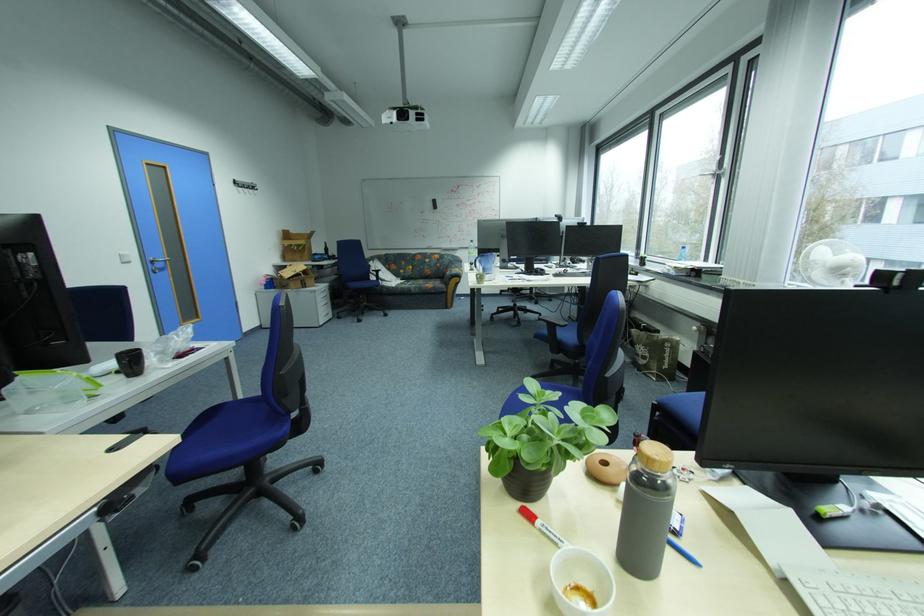
The height and width of the screenshot is (616, 924). Find the location of `sofa armrest`. sofa armrest is located at coordinates (454, 267).